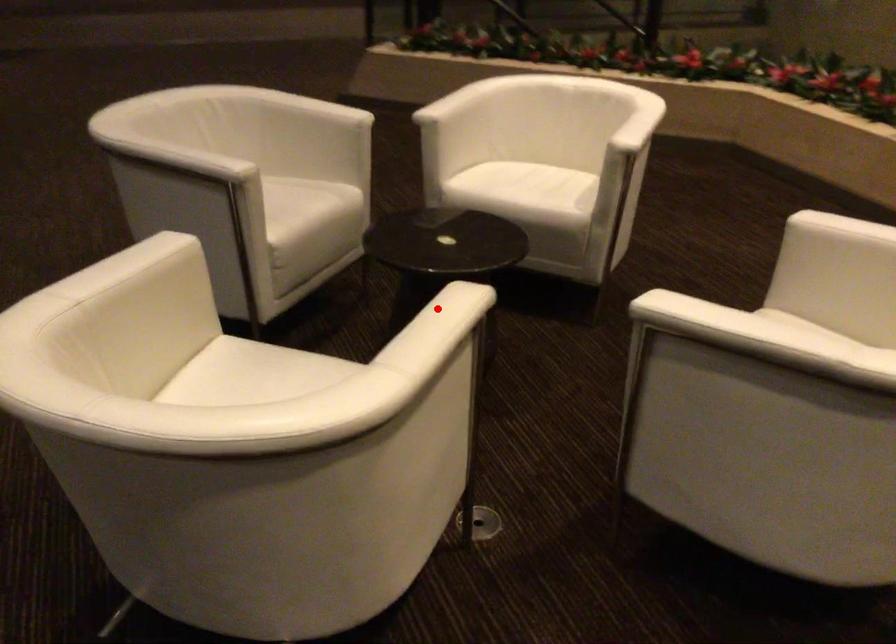
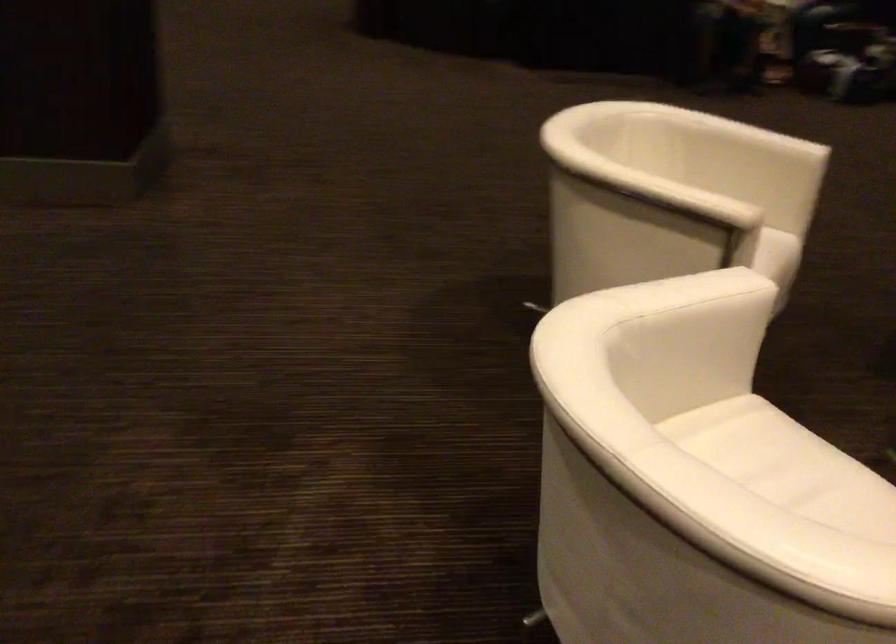
Question: I am providing you with two images of the same scene from different viewpoints. A red point is marked on the first image. Is the red point's position out of view in image 2?

Choices:
 (A) Yes
 (B) No

Answer: (A)